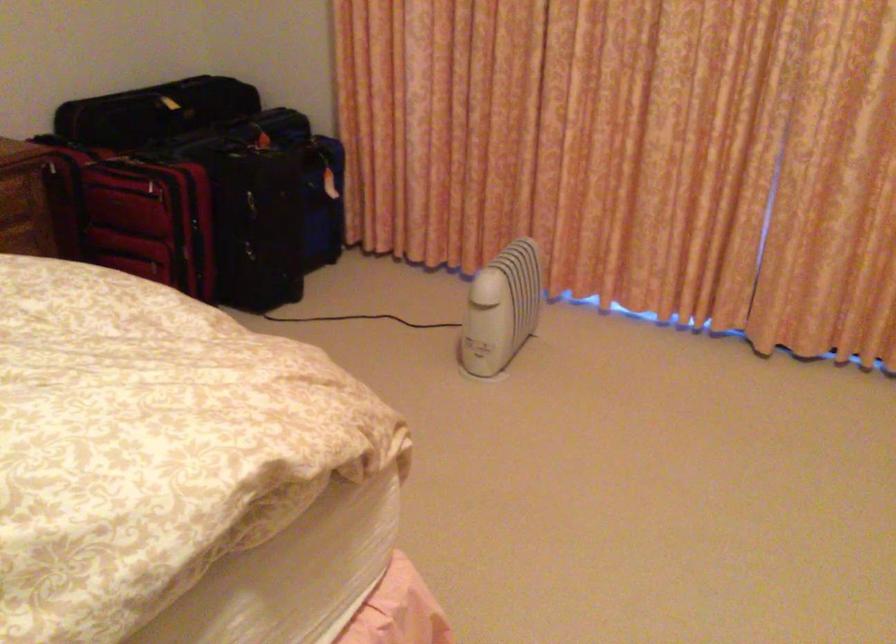
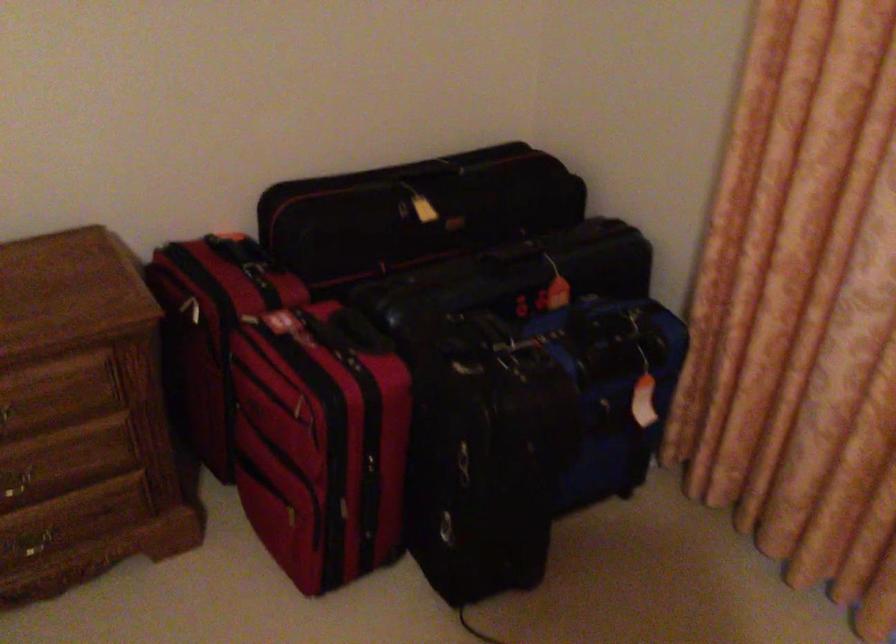
Question: What movement of the cameraman would produce the second image?

Choices:
 (A) Left
 (B) Right
 (C) Forward
 (D) Backward

Answer: (C)